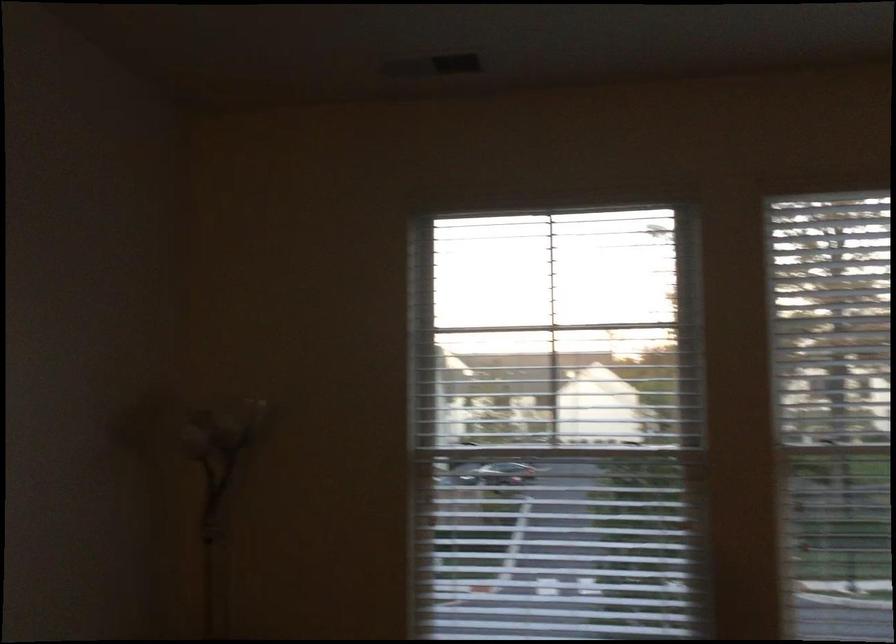
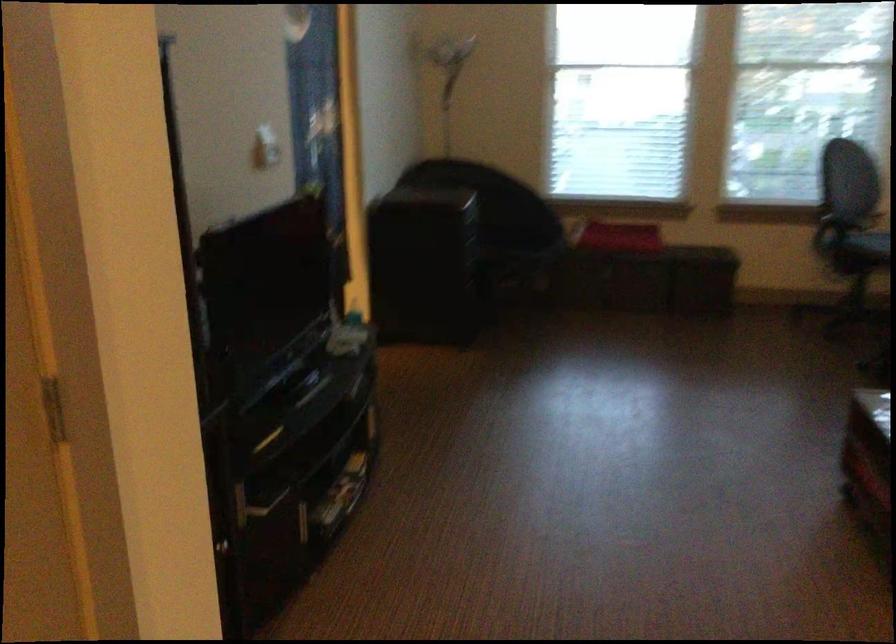
Question: Which direction would the cameraman need to move to produce the second image? Reply with the corresponding letter.

Choices:
 (A) Left
 (B) Right
 (C) Forward
 (D) Backward

Answer: (D)